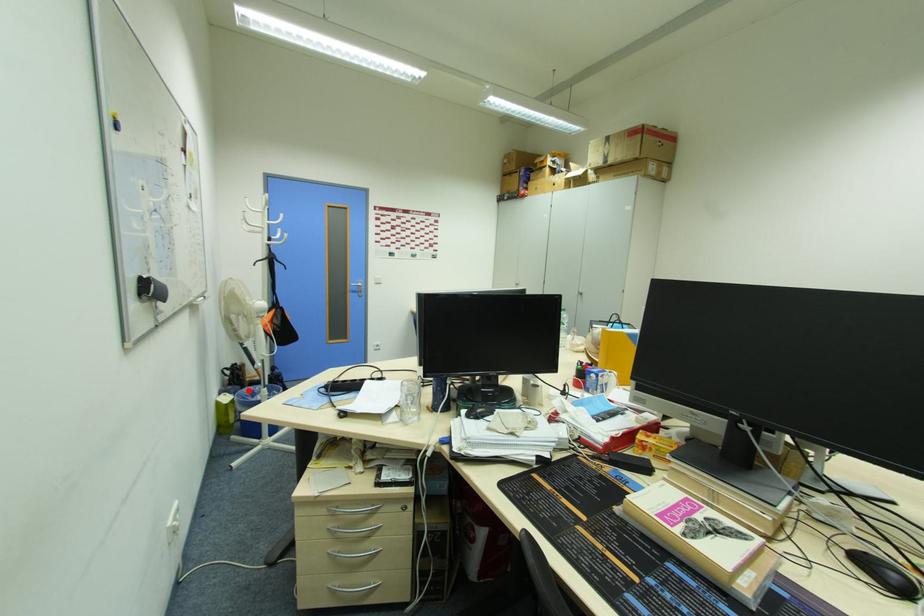
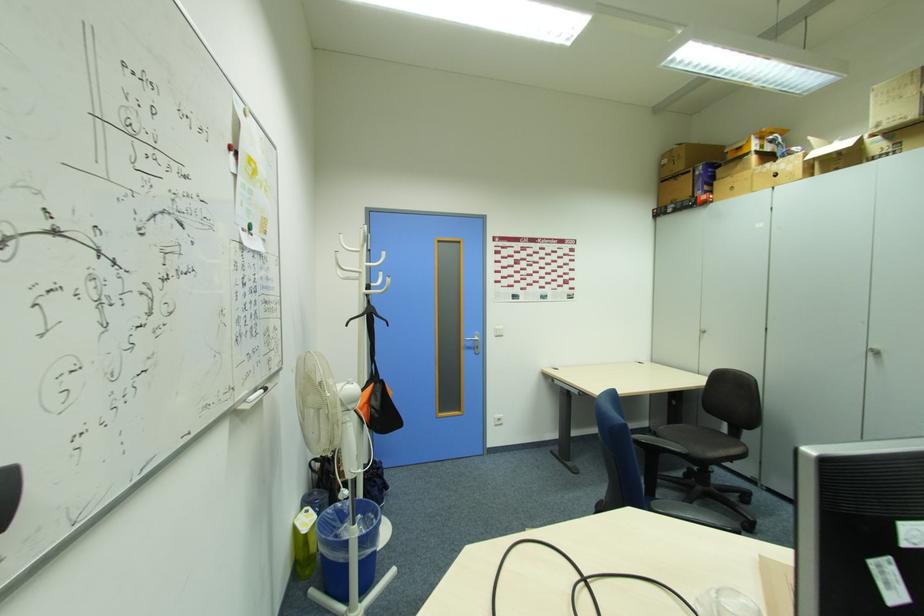
Locate, in the second image, the point that corresponds to the highlighted location in the first image.

(334, 512)